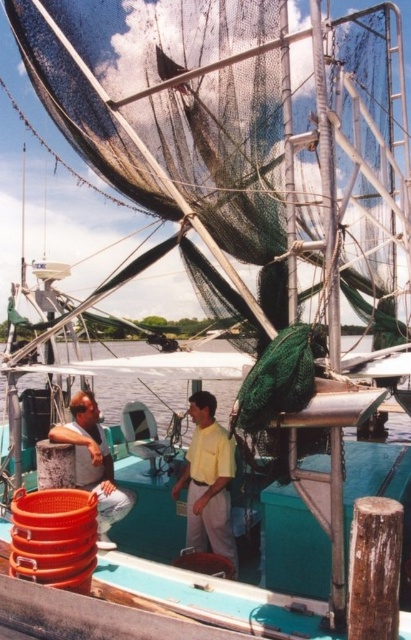
Is point (205, 518) positioned behind point (74, 449)?

Yes, point (205, 518) is behind point (74, 449).

Which of these two, yellow matte shirt at center or matte orange bucket at lower left, stands taller?

yellow matte shirt at center is taller.

What do you see at coordinates (207, 481) in the screenshot?
I see `yellow matte shirt at center` at bounding box center [207, 481].

Where is `yellow matte shirt at center`? This screenshot has width=411, height=640. yellow matte shirt at center is located at coordinates (207, 481).

Which is more to the left, yellow matte shirt at center or green net at lower center?

Positioned to the left is green net at lower center.

Which is more to the right, yellow matte shirt at center or green net at lower center?

From the viewer's perspective, yellow matte shirt at center appears more on the right side.

Image resolution: width=411 pixels, height=640 pixels. I want to click on yellow matte shirt at center, so click(207, 481).

Where is `yellow matte shirt at center`? Image resolution: width=411 pixels, height=640 pixels. yellow matte shirt at center is located at coordinates (207, 481).

Between green net at lower center and matte orange bucket at lower left, which one appears on the right side from the viewer's perspective?

matte orange bucket at lower left

Is green net at lower center below matte orange bucket at lower left?

No, green net at lower center is not below matte orange bucket at lower left.

What do you see at coordinates (140, 396) in the screenshot? I see `green net at lower center` at bounding box center [140, 396].

Identify the location of green net at lower center. (140, 396).